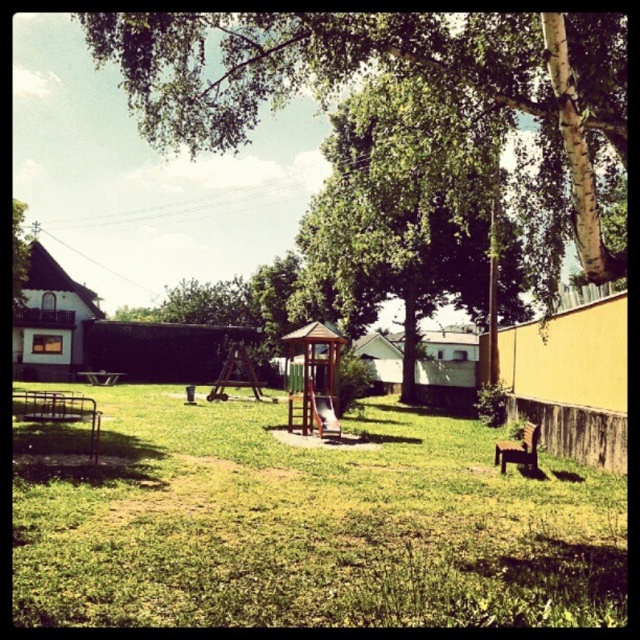
Question: Is the position of green leafy tree at upper left less distant than that of wooden picnic table at lower left?

Choices:
 (A) no
 (B) yes

Answer: (B)

Question: Based on their relative distances, which object is farther from the green grassy at center?

Choices:
 (A) green leafy tree at upper center
 (B) wooden picnic table at lower left
 (C) green leafy tree at upper left

Answer: (B)

Question: Based on their relative distances, which object is nearer to the wooden picnic table at lower left?

Choices:
 (A) green leafy tree at center
 (B) green leafy tree at upper left
 (C) green grassy at center

Answer: (B)

Question: Is green leafy tree at center to the left of green leafy tree at upper left from the viewer's perspective?

Choices:
 (A) no
 (B) yes

Answer: (A)

Question: Can you confirm if green grassy at center is bigger than green leafy tree at center?

Choices:
 (A) no
 (B) yes

Answer: (A)

Question: Which is farther from the green grassy at center?

Choices:
 (A) green leafy tree at upper left
 (B) green leafy tree at center
 (C) green leafy tree at upper center
 (D) wooden picnic table at lower left

Answer: (D)